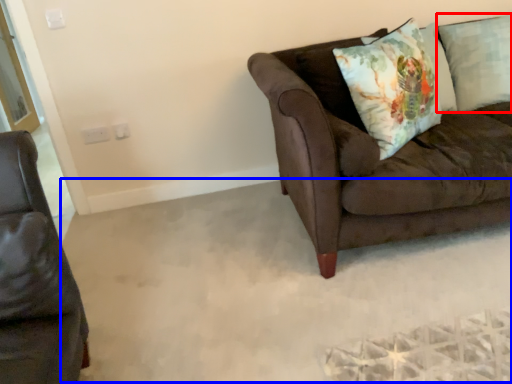
Question: Which of the following is the farthest to the observer, pillow (highlighted by a red box) or plain (highlighted by a blue box)?

Choices:
 (A) pillow
 (B) plain

Answer: (A)